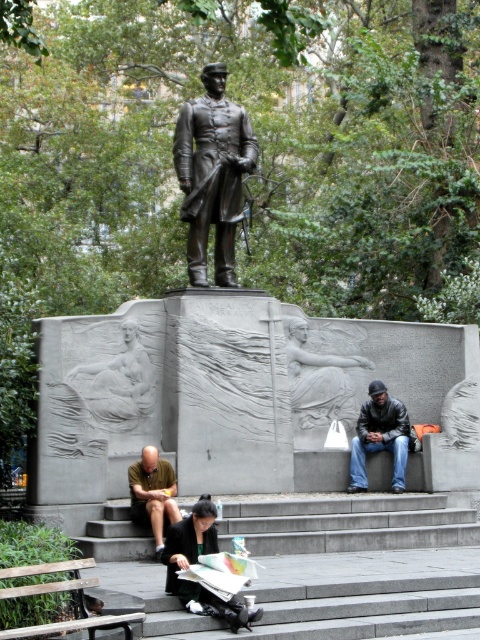
Question: Does leather jacket at lower center lie in front of wooden bench at lower left?

Choices:
 (A) yes
 (B) no

Answer: (B)

Question: Can you confirm if leather jacket at lower center is positioned to the left of wooden bench at lower left?

Choices:
 (A) no
 (B) yes

Answer: (A)

Question: Which object appears farthest from the camera in this image?

Choices:
 (A) bronze statue at center
 (B) wooden bench at lower left

Answer: (A)

Question: Among these objects, which one is farthest from the camera?

Choices:
 (A) leather jacket at lower center
 (B) brown shirt at lower left
 (C) wooden bench at lower left

Answer: (A)

Question: Which object appears closest to the camera in this image?

Choices:
 (A) brown shirt at lower left
 (B) bronze statue at center

Answer: (A)

Question: Is the position of bronze statue at center less distant than that of leather jacket at lower center?

Choices:
 (A) no
 (B) yes

Answer: (A)